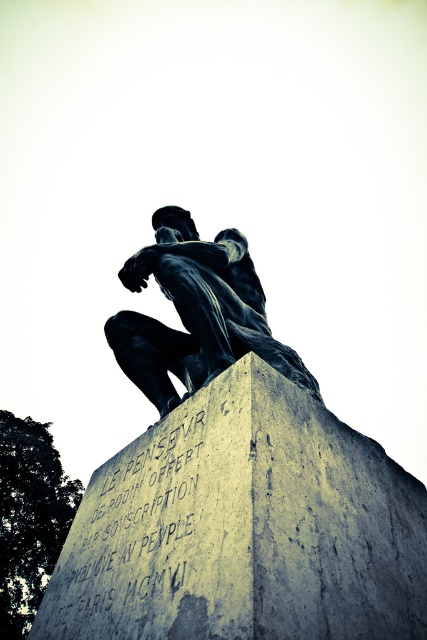
Question: Which of the following is the farthest from the observer?

Choices:
 (A) gray concrete at center
 (B) bronze statue at center

Answer: (B)

Question: Is gray concrete at center behind bronze statue at center?

Choices:
 (A) no
 (B) yes

Answer: (A)

Question: Can you confirm if gray concrete at center is thinner than bronze statue at center?

Choices:
 (A) yes
 (B) no

Answer: (B)

Question: Can you confirm if gray concrete at center is positioned to the left of bronze statue at center?

Choices:
 (A) no
 (B) yes

Answer: (B)

Question: Among these objects, which one is nearest to the camera?

Choices:
 (A) bronze statue at center
 (B) gray concrete at center

Answer: (B)

Question: Which of the following is the closest to the observer?

Choices:
 (A) gray concrete at center
 (B) bronze statue at center

Answer: (A)